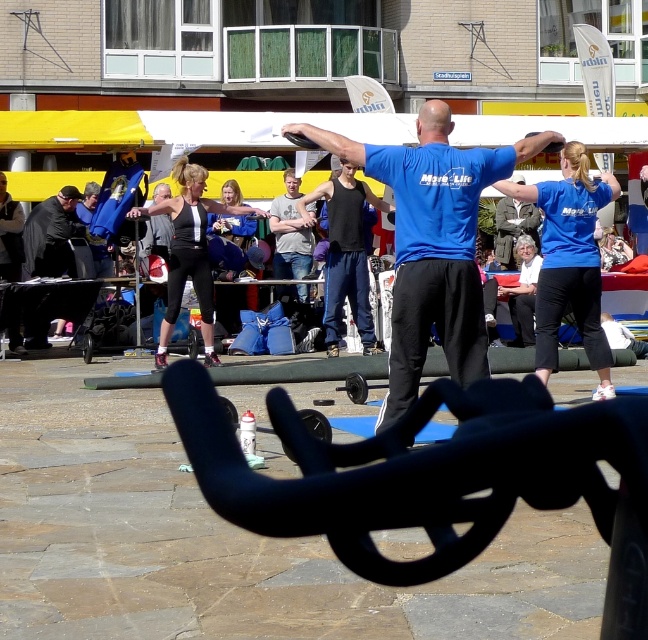
Is matte blue shirt at center above dark gray fabric jacket at left?

Actually, matte blue shirt at center is below dark gray fabric jacket at left.

Describe the element at coordinates (570, 260) in the screenshot. I see `matte blue shirt at center` at that location.

Is point (592, 184) less distant than point (76, 200)?

That is True.

Where is `matte blue shirt at center`? The width and height of the screenshot is (648, 640). matte blue shirt at center is located at coordinates (570, 260).

What do you see at coordinates (570, 260) in the screenshot? I see `matte blue shirt at center` at bounding box center [570, 260].

Is point (553, 259) more distant than point (178, 269)?

No, it is not.

This screenshot has width=648, height=640. Identify the location of matte blue shirt at center. 570,260.

Which is below, black matte leggings at center or dark gray fabric jacket at left?

black matte leggings at center is below.

Can you confirm if black matte leggings at center is positioned to the right of dark gray fabric jacket at left?

Correct, you'll find black matte leggings at center to the right of dark gray fabric jacket at left.

I want to click on black matte leggings at center, so click(x=189, y=252).

The width and height of the screenshot is (648, 640). Find the location of `black matte leggings at center`. black matte leggings at center is located at coordinates (189, 252).